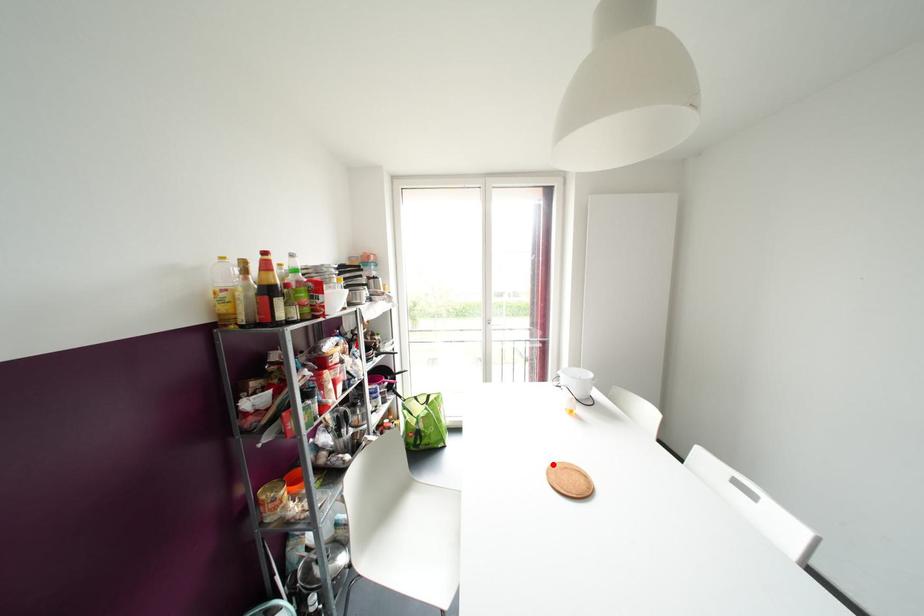
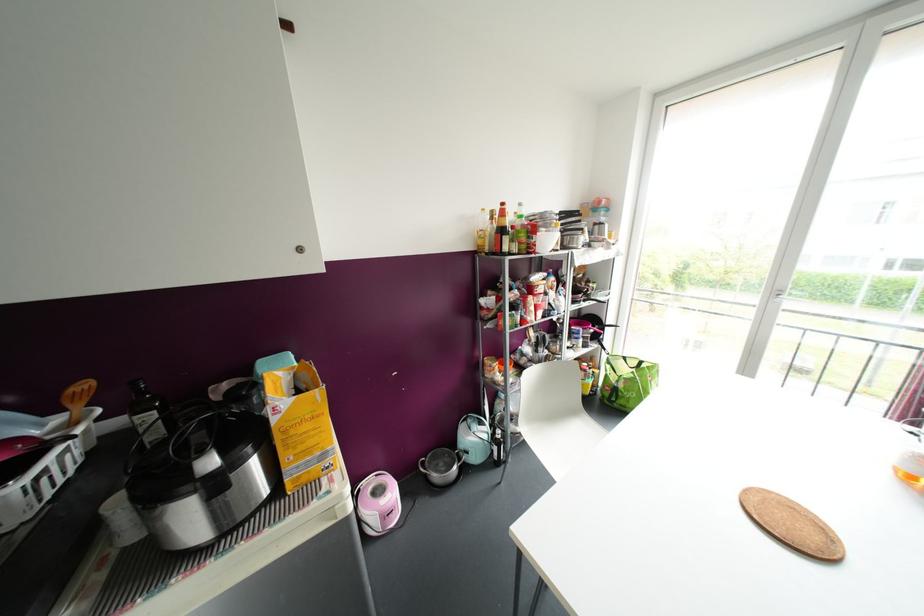
In the second image, find the point that corresponds to the highlighted location in the first image.

(769, 491)